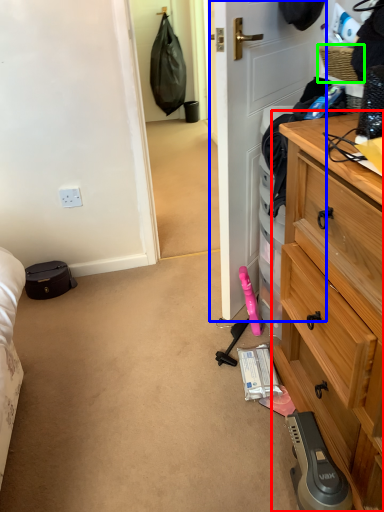
Question: Based on their relative distances, which object is nearer to chest of drawers (highlighted by a red box)? Choose from door (highlighted by a blue box) and picnic basket (highlighted by a green box).

Choices:
 (A) door
 (B) picnic basket

Answer: (A)